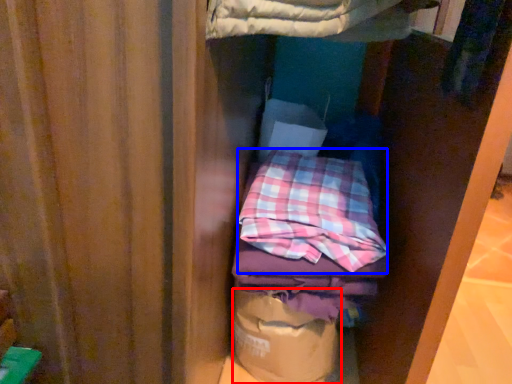
Question: Which object is closer to the camera taking this photo, paper bag (highlighted by a red box) or flannel (highlighted by a blue box)?

Choices:
 (A) paper bag
 (B) flannel

Answer: (B)